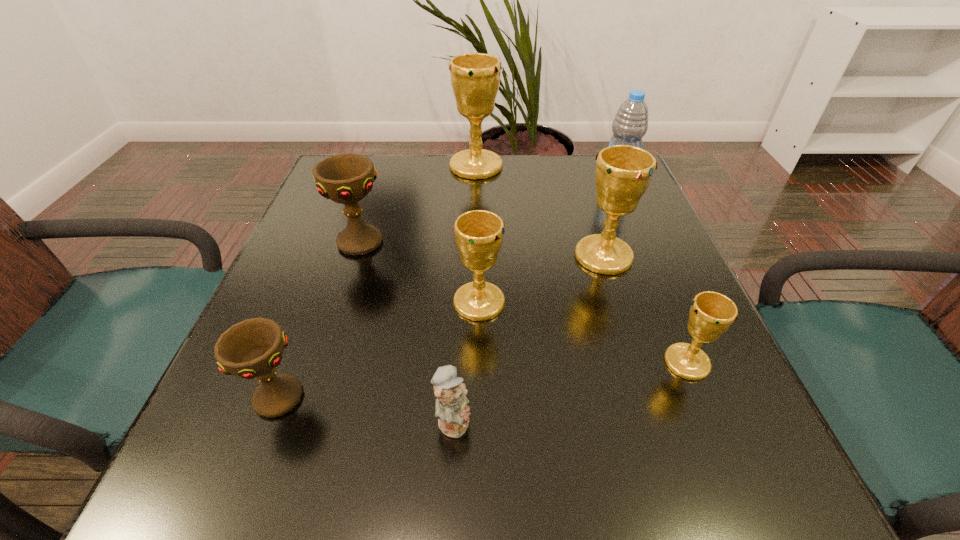
Locate an element on the screen. The height and width of the screenshot is (540, 960). chalice that is at the far edge is located at coordinates (475, 77).

Locate an element on the screen. The width and height of the screenshot is (960, 540). water bottle present at the far edge is located at coordinates (630, 124).

Identify the location of object at the near edge. (452, 411).

Where is `water bottle present at the right edge`? The image size is (960, 540). water bottle present at the right edge is located at coordinates (630, 124).

Find the location of a particular element. This screenshot has height=540, width=960. object located in the far right corner section of the desktop is located at coordinates (630, 124).

The image size is (960, 540). What are the coordinates of `vacant space at the far edge of the desktop` in the screenshot? It's located at (399, 183).

Locate an element on the screen. This screenshot has height=540, width=960. vacant space at the near edge of the desktop is located at coordinates (586, 453).

Image resolution: width=960 pixels, height=540 pixels. What are the coordinates of `free space at the left edge of the desktop` in the screenshot? It's located at (237, 404).

This screenshot has height=540, width=960. In the image, there is a desktop. What are the coordinates of `blank space at the right edge` in the screenshot? It's located at (632, 328).

Locate an element on the screen. free space at the far left corner of the desktop is located at coordinates (313, 202).